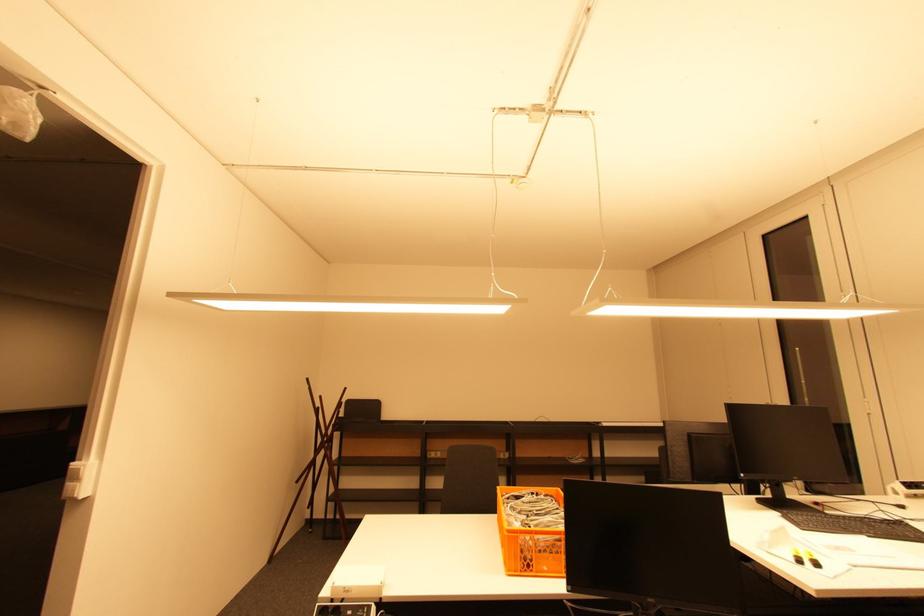
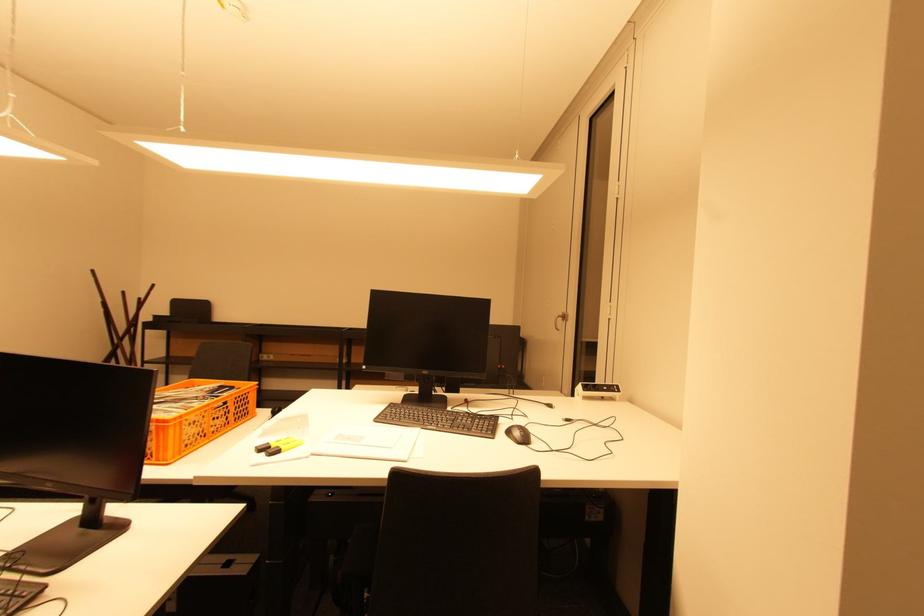
Question: Which direction would the cameraman need to move to produce the second image? Reply with the corresponding letter.

Choices:
 (A) Left
 (B) Right
 (C) Forward
 (D) Backward

Answer: (B)